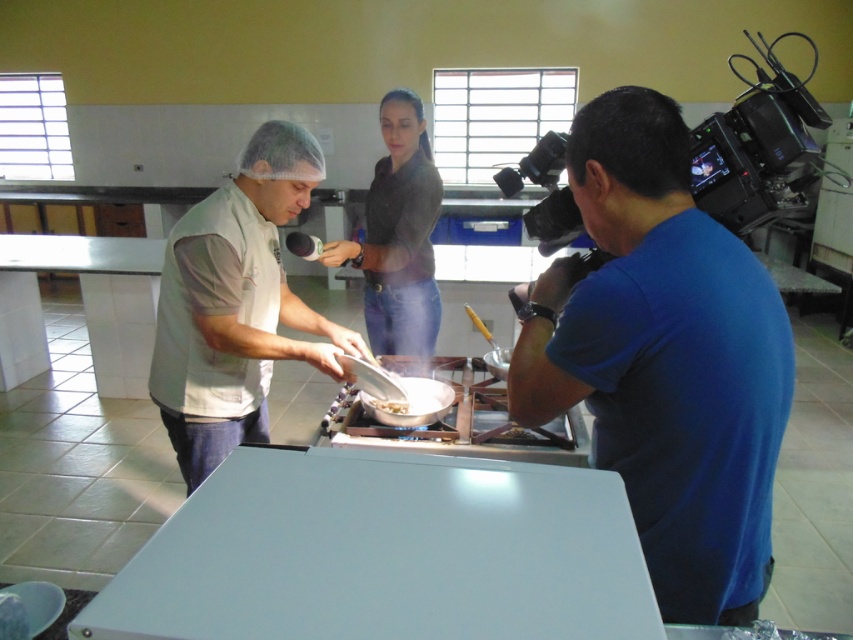
Question: Is smooth matte gray table at center wider than white fabric chef hat at upper center?

Choices:
 (A) yes
 (B) no

Answer: (B)

Question: Which point appears farthest from the camera in this image?

Choices:
 (A) (386, 404)
 (B) (331, 579)
 (C) (18, 243)

Answer: (C)

Question: Which object is closer to the camera taking this photo?

Choices:
 (A) black plastic video camera at right
 (B) white glossy pan at center
 (C) blue cotton shirt at right
 (D) white fabric chef hat at upper center

Answer: (C)

Question: Which point is closer to the camera?

Choices:
 (A) (218, 372)
 (B) (7, 248)
 (C) (94, 632)

Answer: (C)

Question: Can you confirm if black plastic video camera at right is positioned to the right of white glossy table at left?

Choices:
 (A) no
 (B) yes

Answer: (B)

Question: Is white fabric chef hat at upper center positioned in front of white glossy table at left?

Choices:
 (A) yes
 (B) no

Answer: (A)